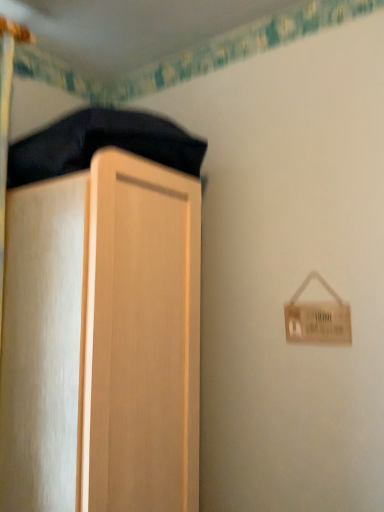
Question: Considering the positions of velvet dark blue blanket at upper left and light wood cupboard at left in the image, is velvet dark blue blanket at upper left taller or shorter than light wood cupboard at left?

Choices:
 (A) tall
 (B) short

Answer: (B)

Question: Looking at the image, does velvet dark blue blanket at upper left seem bigger or smaller compared to light wood cupboard at left?

Choices:
 (A) big
 (B) small

Answer: (B)

Question: From a real-world perspective, is velvet dark blue blanket at upper left physically located above or below light wood cupboard at left?

Choices:
 (A) below
 (B) above

Answer: (B)

Question: Considering their positions, is light wood cupboard at left located in front of or behind velvet dark blue blanket at upper left?

Choices:
 (A) front
 (B) behind

Answer: (A)

Question: In terms of height, does light wood cupboard at left look taller or shorter compared to velvet dark blue blanket at upper left?

Choices:
 (A) tall
 (B) short

Answer: (A)

Question: From a real-world perspective, relative to velvet dark blue blanket at upper left, is light wood cupboard at left vertically above or below?

Choices:
 (A) above
 (B) below

Answer: (B)

Question: Is point (18, 444) positioned closer to the camera than point (9, 168)?

Choices:
 (A) closer
 (B) farther

Answer: (A)